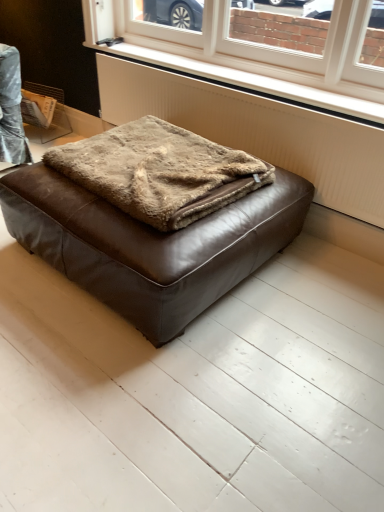
Find the location of `free space below white plastic window at upper center (from a real-world perspective)`. free space below white plastic window at upper center (from a real-world perspective) is located at coordinates (274, 82).